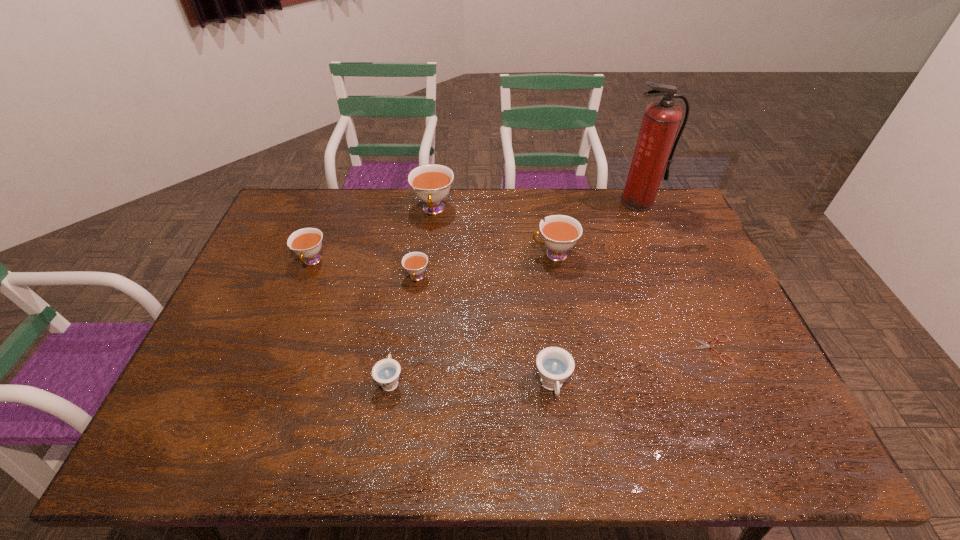
Identify the location of the tallest object. (661, 120).

Locate an element on the screen. Image resolution: width=960 pixels, height=540 pixels. fire extinguisher is located at coordinates (661, 120).

The height and width of the screenshot is (540, 960). I want to click on the farthest white teacup, so click(431, 183).

Find the location of a particular element. Image resolution: width=960 pixels, height=540 pixels. the second tallest object is located at coordinates (431, 183).

Locate an element on the screen. The width and height of the screenshot is (960, 540). the second tallest teacup is located at coordinates (560, 233).

Find the location of a particular element. This screenshot has width=960, height=540. the sixth shortest object is located at coordinates (560, 233).

In order to click on the leftmost object in this screenshot , I will do `click(306, 242)`.

What are the coordinates of `the leftmost teacup` in the screenshot? It's located at (306, 242).

Image resolution: width=960 pixels, height=540 pixels. In order to click on the right blue teacup in this screenshot , I will do `click(555, 365)`.

I want to click on the smallest white teacup, so click(415, 263).